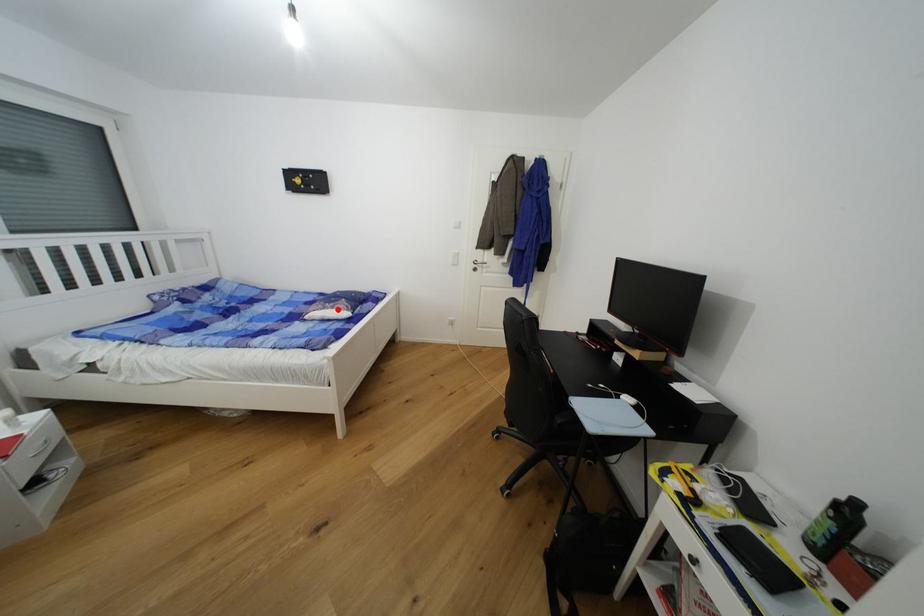
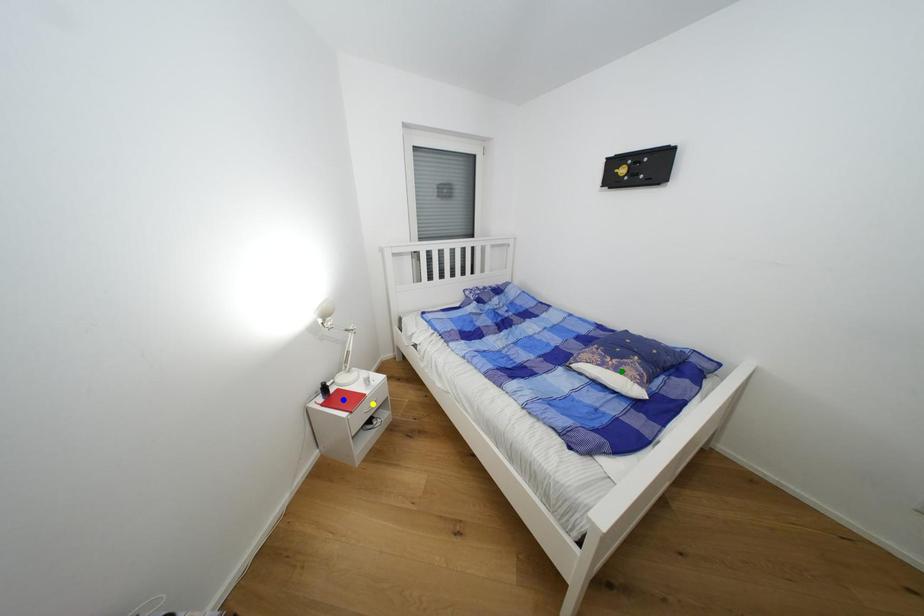
Question: I am providing you with two images of the same scene from different viewpoints. A red point is marked on the first image. You are given multiple points on the second image. Which mark in image 2 goes with the point in image 1?

Choices:
 (A) yellow point
 (B) green point
 (C) blue point

Answer: (B)